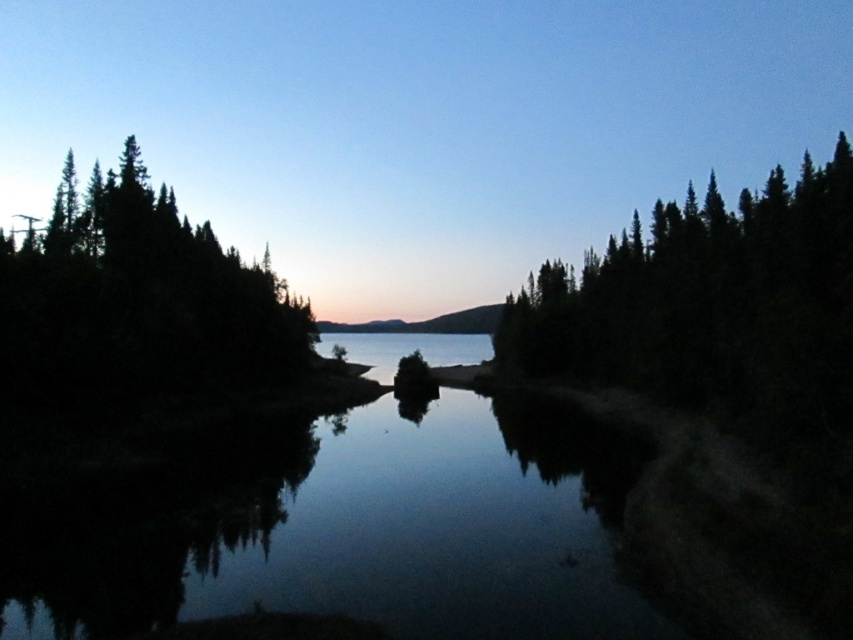
Which is above, dark green textured trees at right or dark green textured trees at left?

dark green textured trees at right

Does dark green textured trees at right come behind dark green textured trees at left?

No, dark green textured trees at right is closer to the viewer.

The height and width of the screenshot is (640, 853). Describe the element at coordinates (709, 300) in the screenshot. I see `dark green textured trees at right` at that location.

The height and width of the screenshot is (640, 853). In order to click on dark green textured trees at right in this screenshot , I will do `click(709, 300)`.

What do you see at coordinates (138, 300) in the screenshot? I see `dark green textured trees at left` at bounding box center [138, 300].

Who is shorter, dark green textured trees at left or transparent glass water at center?

With less height is transparent glass water at center.

Who is more distant from viewer, (77, 218) or (416, 348)?

Point (416, 348)

I want to click on dark green textured trees at left, so click(x=138, y=300).

How far apart are dark green textured trees at right and transparent glass water at center?

161.24 feet

Can you confirm if dark green textured trees at right is shorter than transparent glass water at center?

Incorrect, dark green textured trees at right's height does not fall short of transparent glass water at center's.

This screenshot has width=853, height=640. Describe the element at coordinates (709, 300) in the screenshot. I see `dark green textured trees at right` at that location.

Where is `dark green textured trees at right`? The image size is (853, 640). dark green textured trees at right is located at coordinates (709, 300).